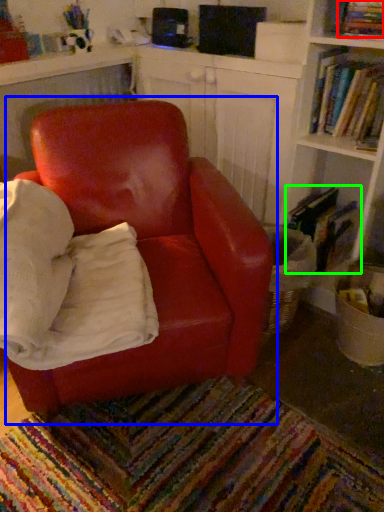
Question: Based on their relative distances, which object is nearer to book (highlighted by a red box)? Choose from chair (highlighted by a blue box) and book (highlighted by a green box).

Choices:
 (A) chair
 (B) book

Answer: (B)